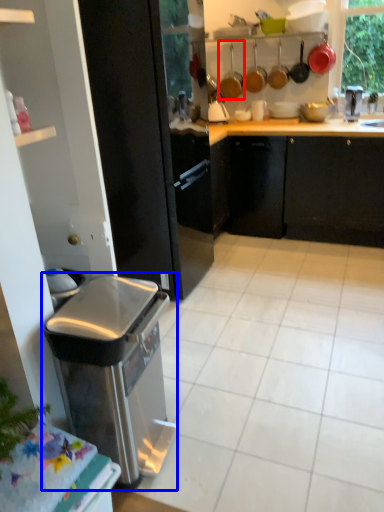
Question: Which of the following is the farthest to the observer, appliance (highlighted by a red box) or home appliance (highlighted by a blue box)?

Choices:
 (A) appliance
 (B) home appliance

Answer: (A)